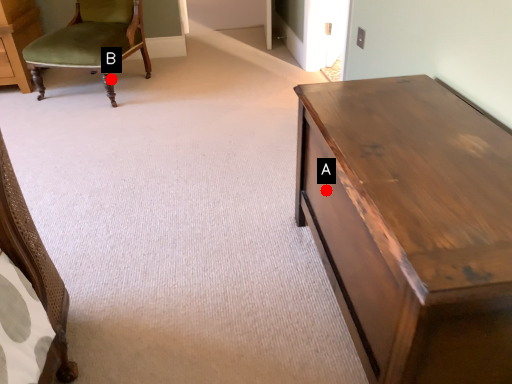
Question: Two points are circled on the image, labeled by A and B beside each circle. Which point is closer to the camera taking this photo?

Choices:
 (A) A is closer
 (B) B is closer

Answer: (A)